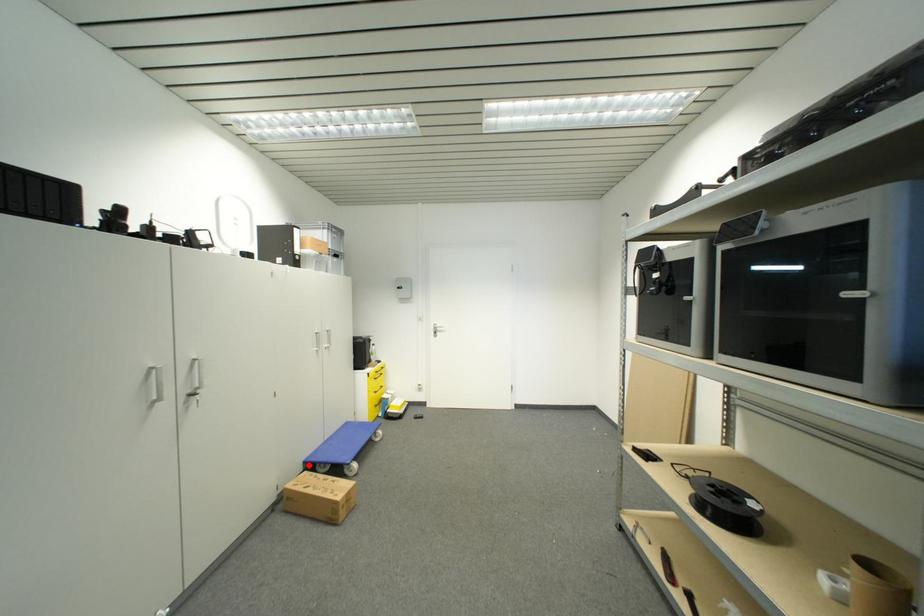
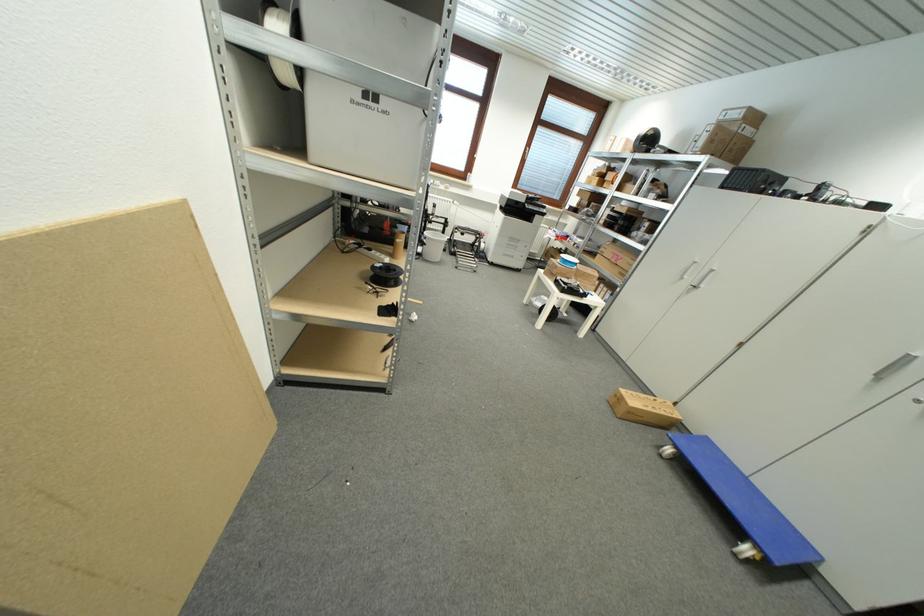
Where in the second image is the point corresponding to the highlighted location from the first image?

(711, 440)